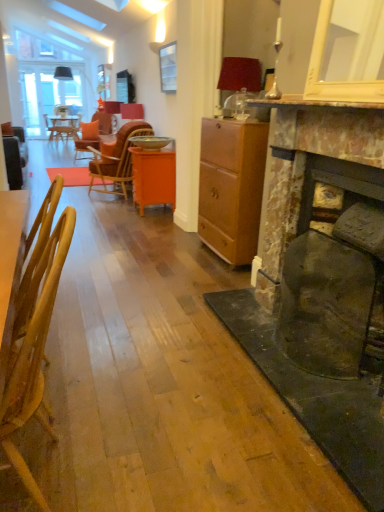
Question: Considering the positions of point (162, 143) and point (59, 238), is point (162, 143) closer or farther from the camera than point (59, 238)?

Choices:
 (A) farther
 (B) closer

Answer: (A)

Question: From the image's perspective, is metallic gold bowl at center located above or below wooden chair at left, which appears as the second chair when viewed from the back?

Choices:
 (A) above
 (B) below

Answer: (A)

Question: Which object is positioned farthest from the matte red lampshade at upper right, marked as the second lamp in a back-to-front arrangement?

Choices:
 (A) wooden chair at left, the second chair from the top
 (B) orange wood chair at center, the second chair in the bottom-to-top sequence
 (C) orange glossy cabinet at center
 (D) matte brown cabinet at center
 (E) clear glass picture frame at upper center

Answer: (A)

Question: Estimate the real-world distances between objects in this image. Which object is farther from the matte brown cabinet at center?

Choices:
 (A) orange glossy cabinet at center
 (B) metallic gold bowl at center
 (C) rusty stone fireplace at right
 (D) matte red lampshade at upper right, the 1th lamp when ordered from bottom to top
 (E) orange wood chair at center, marked as the first chair in a top-to-bottom arrangement

Answer: (E)